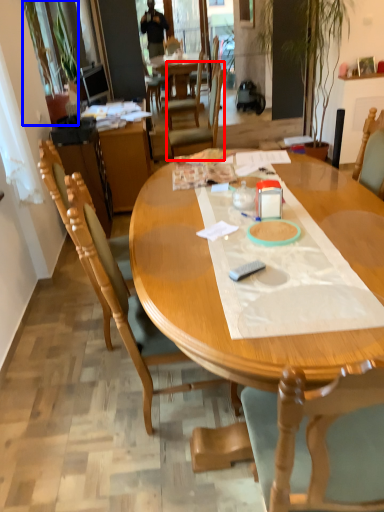
Question: Which object is closer to the camera taking this photo, chair (highlighted by a red box) or houseplant (highlighted by a blue box)?

Choices:
 (A) chair
 (B) houseplant

Answer: (B)